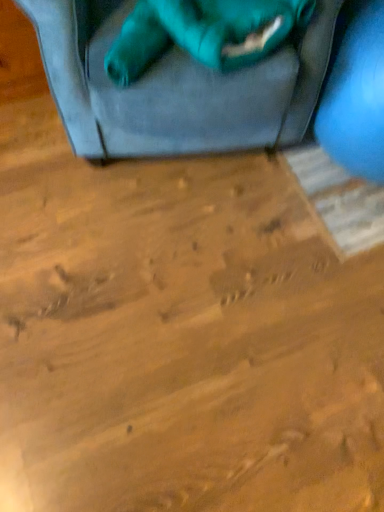
Question: Considering the positions of matte blue exercise ball at right and teal fabric cat at upper center in the image, is matte blue exercise ball at right bigger or smaller than teal fabric cat at upper center?

Choices:
 (A) big
 (B) small

Answer: (A)

Question: Is matte blue exercise ball at right inside or outside of teal fabric cat at upper center?

Choices:
 (A) outside
 (B) inside

Answer: (A)

Question: In the image, is matte blue exercise ball at right on the left side or the right side of teal fabric cat at upper center?

Choices:
 (A) right
 (B) left

Answer: (A)

Question: From a real-world perspective, is teal fabric cat at upper center positioned above or below matte blue exercise ball at right?

Choices:
 (A) above
 (B) below

Answer: (A)

Question: Is teal fabric cat at upper center in front of or behind matte blue exercise ball at right in the image?

Choices:
 (A) behind
 (B) front

Answer: (A)

Question: Looking at the image, does teal fabric cat at upper center seem bigger or smaller compared to matte blue exercise ball at right?

Choices:
 (A) big
 (B) small

Answer: (B)

Question: Is point (x=203, y=17) positioned closer to the camera than point (x=362, y=177)?

Choices:
 (A) farther
 (B) closer

Answer: (B)